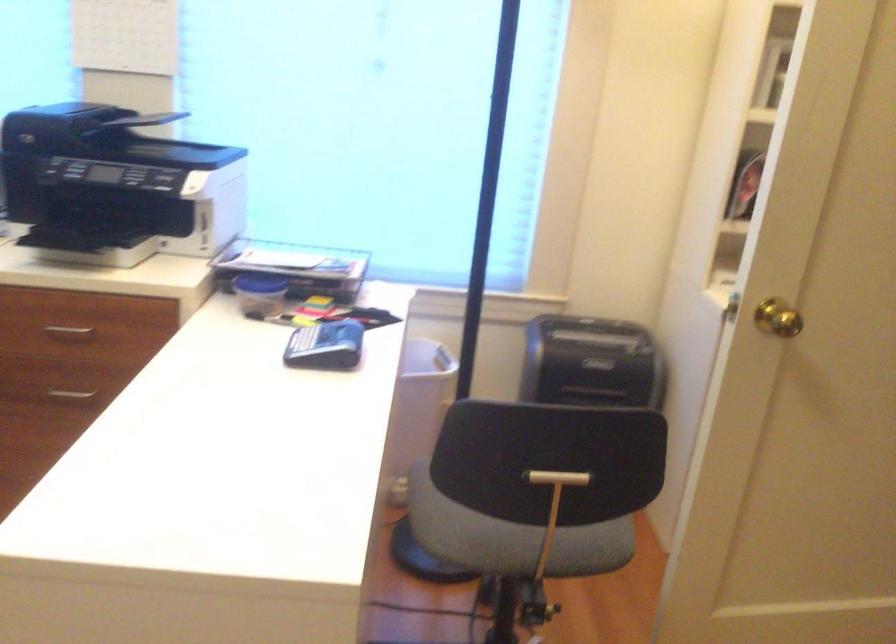
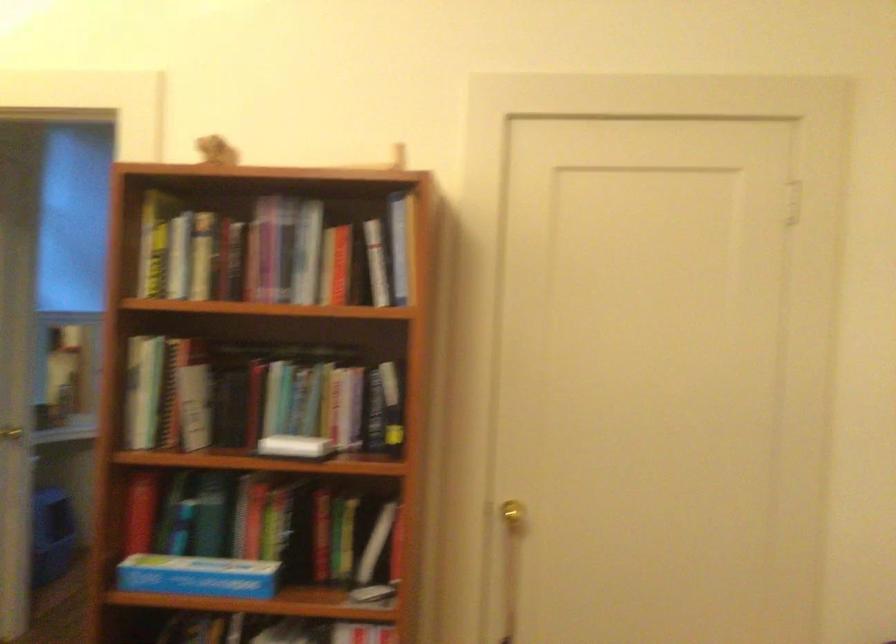
Question: The camera is either moving clockwise (left) or counter-clockwise (right) around the object. The first image is from the beginning of the video and the second image is from the end. Is the camera moving left or right when shooting the video?

Choices:
 (A) Left
 (B) Right

Answer: (A)